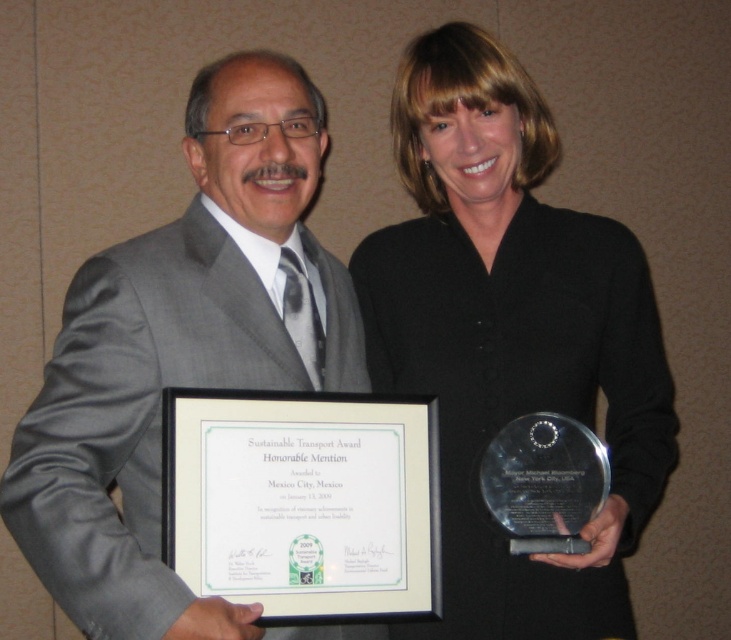
Who is lower down, black matte award at center or gray suit at center?

gray suit at center is lower down.

Can you confirm if black matte award at center is positioned below gray suit at center?

No, black matte award at center is not below gray suit at center.

Between point (628, 365) and point (148, 412), which one is positioned behind?

Point (628, 365)

Identify the location of black matte award at center. (511, 336).